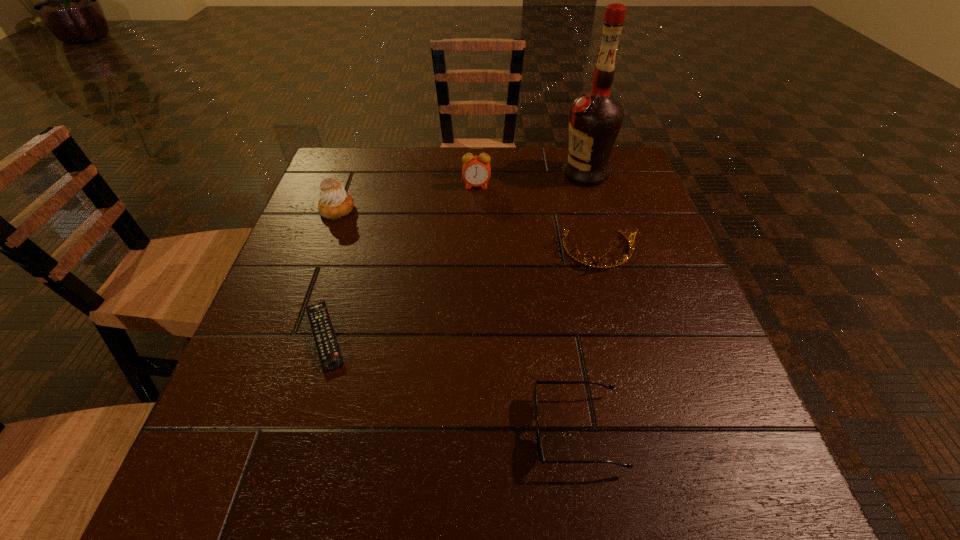
Image resolution: width=960 pixels, height=540 pixels. In order to click on the tallest object in this screenshot , I will do `click(595, 119)`.

The height and width of the screenshot is (540, 960). What are the coordinates of `alarm clock` in the screenshot? It's located at (476, 171).

The width and height of the screenshot is (960, 540). I want to click on the fourth object from right to left, so click(476, 171).

At what (x,y) coordinates should I click in order to perform the action: click on pastry. Please return your answer as a coordinate pair (x, y). Looking at the image, I should click on (335, 202).

Locate an element on the screen. The width and height of the screenshot is (960, 540). the third shortest object is located at coordinates (615, 263).

Where is `the fourth farthest object`? the fourth farthest object is located at coordinates (615, 263).

I want to click on the nearest object, so pyautogui.click(x=539, y=451).

Where is `sunglasses`? The width and height of the screenshot is (960, 540). sunglasses is located at coordinates (539, 451).

Locate an element on the screen. the fifth farthest object is located at coordinates (330, 356).

Find the location of a particular element. Image resolution: width=960 pixels, height=540 pixels. remote control is located at coordinates (330, 356).